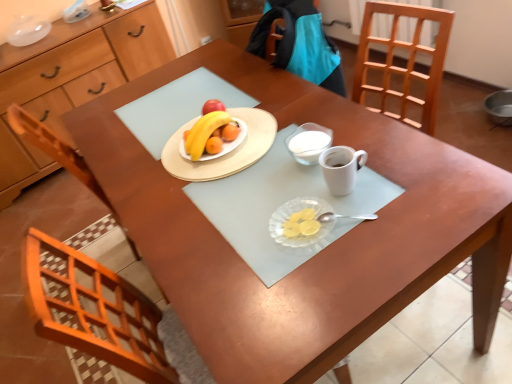
Identify the location of free space on the front side of matte wooden plate at center. The height and width of the screenshot is (384, 512). (234, 206).